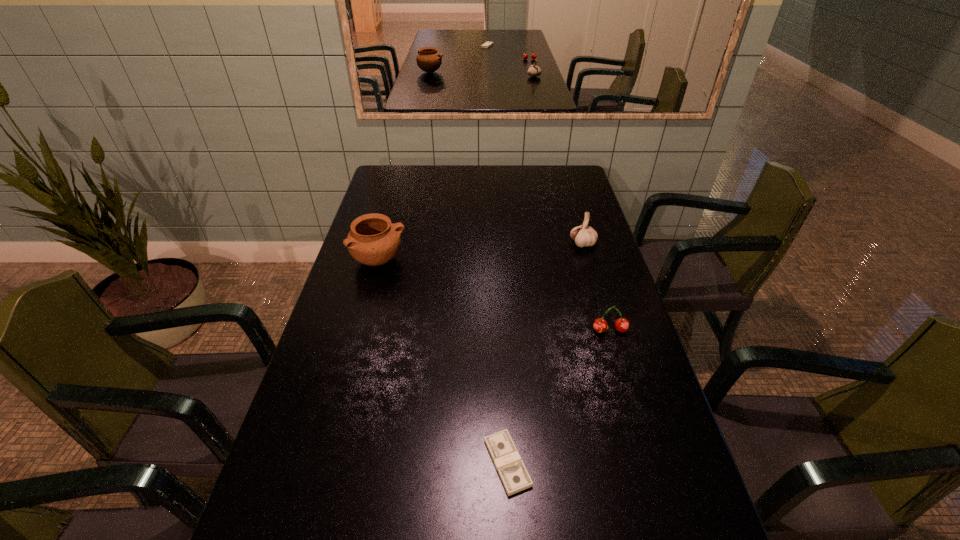
You are a GUI agent. You are given a task and a screenshot of the screen. Output one action in this format:
    pyautogui.click(x=<x>, y=<y>)
    Task: Click on the vacant region located 0.080m on the left of the dollar
    Image resolution: width=960 pixels, height=540 pixels.
    Given the screenshot: What is the action you would take?
    pyautogui.click(x=447, y=463)

Find the location of a particular element. The height and width of the screenshot is (540, 960). object that is at the left edge is located at coordinates (373, 240).

Find the location of `garlic present at the right edge`. garlic present at the right edge is located at coordinates (584, 235).

Identify the location of cherry situated at the right edge. (600, 325).

In the image, there is a desktop. At what (x,y) coordinates should I click in order to perform the action: click on free space at the far edge. Please return your answer as a coordinate pair (x, y). The height and width of the screenshot is (540, 960). Looking at the image, I should click on (485, 171).

Find the location of a particular element. The image size is (960, 540). free location at the left edge is located at coordinates (386, 200).

Find the location of a particular element. vacant region at the right edge is located at coordinates point(645,443).

You are a GUI agent. You are given a task and a screenshot of the screen. Output one action in this format:
    pyautogui.click(x=<x>, y=<y>)
    Task: Click on the free space between the second object from left to right and the second tallest object
    
    Given the screenshot: What is the action you would take?
    pyautogui.click(x=545, y=353)

This screenshot has width=960, height=540. Find the location of `free spot between the tallest object and the second tallest object`. free spot between the tallest object and the second tallest object is located at coordinates (481, 252).

Identify the location of free space between the tallest object and the nearest object. Image resolution: width=960 pixels, height=540 pixels. (444, 361).